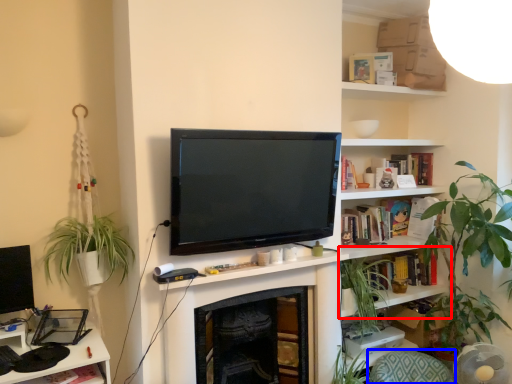
Question: Among these objects, which one is nearest to the camera, shelf (highlighted by a red box) or swivel chair (highlighted by a blue box)?

Choices:
 (A) shelf
 (B) swivel chair

Answer: (B)